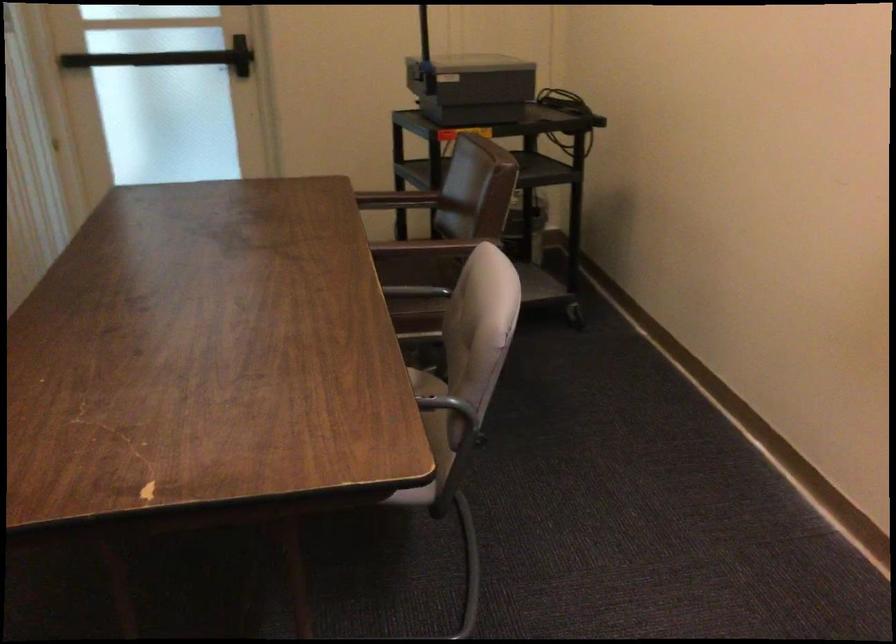
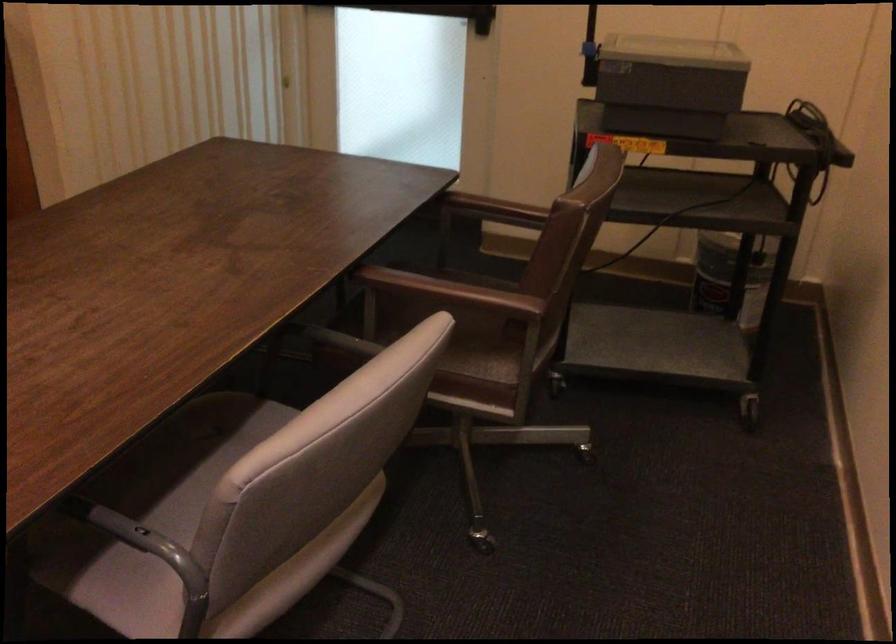
The images are taken continuously from a first-person perspective. In which direction are you moving?

The cameraman walked toward right, forward.